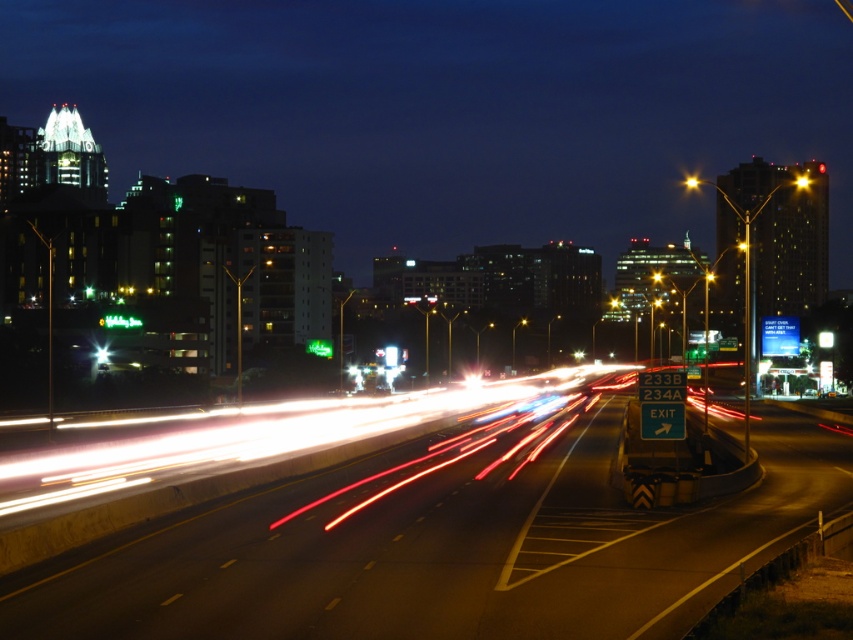
Is metallic asphalt highway at center wider than bright yellow streetlight at center-right?

Yes, metallic asphalt highway at center is wider than bright yellow streetlight at center-right.

Can you confirm if metallic asphalt highway at center is taller than bright yellow streetlight at center-right?

No.

Find the location of a particular element. metallic asphalt highway at center is located at coordinates (440, 547).

Identify the location of metallic asphalt highway at center. (440, 547).

Is the position of yellow plastic traffic light at center-right more distant than that of bright yellow streetlight at center-right?

No, yellow plastic traffic light at center-right is in front of bright yellow streetlight at center-right.

Between yellow plastic traffic light at center-right and bright yellow streetlight at center-right, which one is positioned lower?

yellow plastic traffic light at center-right is lower down.

Image resolution: width=853 pixels, height=640 pixels. Find the location of `yellow plastic traffic light at center-right`. yellow plastic traffic light at center-right is located at coordinates (802, 180).

Who is positioned more to the left, metallic asphalt highway at center or yellow plastic traffic light at center-right?

From the viewer's perspective, metallic asphalt highway at center appears more on the left side.

Locate an element on the screen. The width and height of the screenshot is (853, 640). metallic asphalt highway at center is located at coordinates (440, 547).